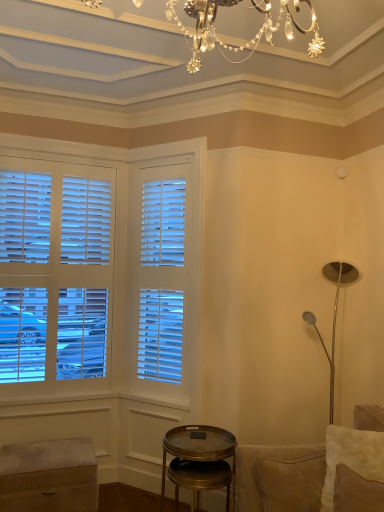
Question: Is suede couch at right in front of or behind white fluffy pillow at lower right in the image?

Choices:
 (A) behind
 (B) front

Answer: (B)

Question: Is suede couch at right situated inside white fluffy pillow at lower right or outside?

Choices:
 (A) inside
 (B) outside

Answer: (B)

Question: Estimate the real-world distances between objects in this image. Which object is farther from the velvet ottoman at lower left?

Choices:
 (A) metallic gold side table at lower center
 (B) white fluffy pillow at lower right
 (C) suede couch at right

Answer: (B)

Question: Which object is the closest to the velvet ottoman at lower left?

Choices:
 (A) white fluffy pillow at lower right
 (B) metallic gold side table at lower center
 (C) suede couch at right

Answer: (B)